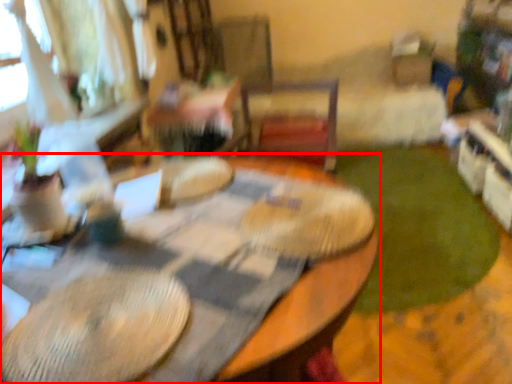
Question: From the image's perspective, where is table (annotated by the red box) located in relation to grass in the image?

Choices:
 (A) above
 (B) below

Answer: (B)